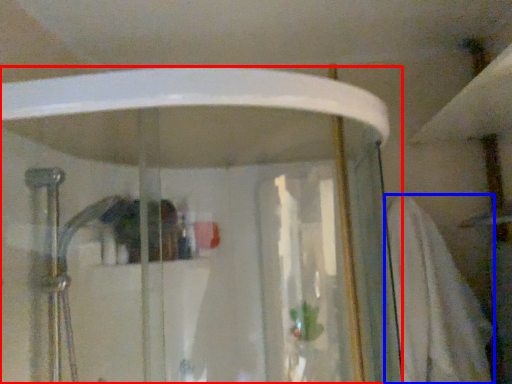
Question: Which object appears closest to the camera in this image, shower door (highlighted by a red box) or bath towel (highlighted by a blue box)?

Choices:
 (A) shower door
 (B) bath towel

Answer: (A)